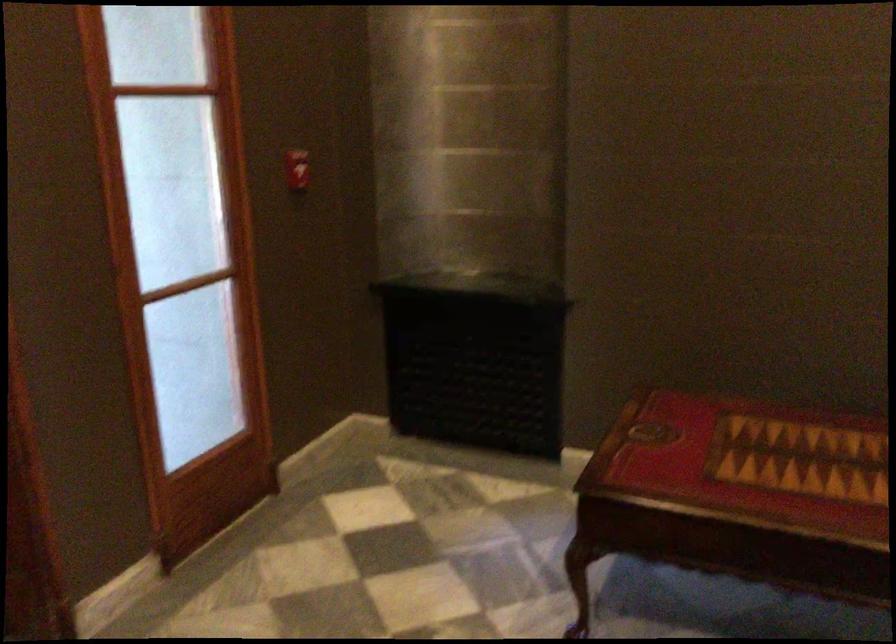
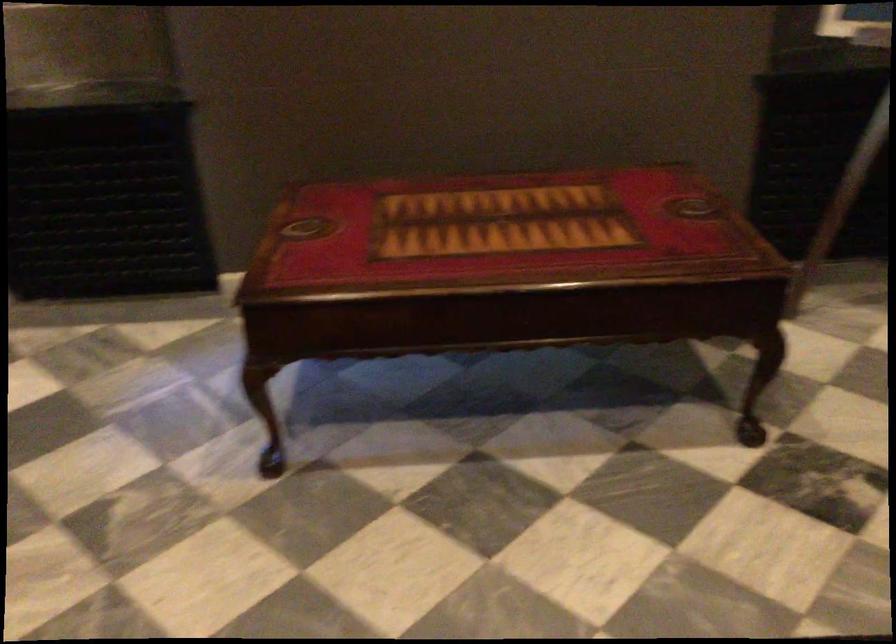
The images are taken continuously from a first-person perspective. In which direction are you moving?

The movement direction of the cameraman is right, forward.